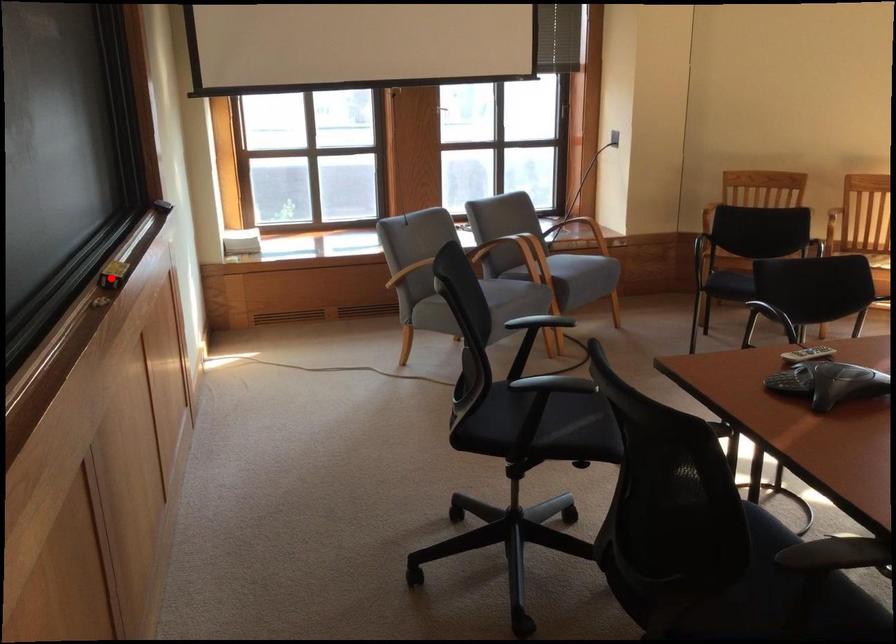
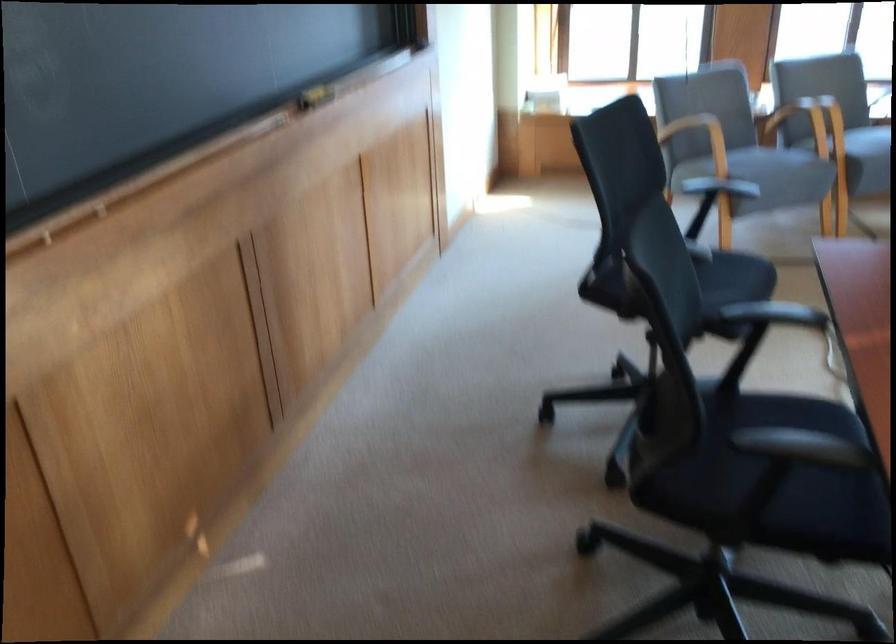
Question: I am providing you with two images of the same scene from different viewpoints. Given a red point in image1, look at the same physical point in image2. Is it:

Choices:
 (A) Closer to the viewpoint
 (B) Farther from the viewpoint

Answer: (B)